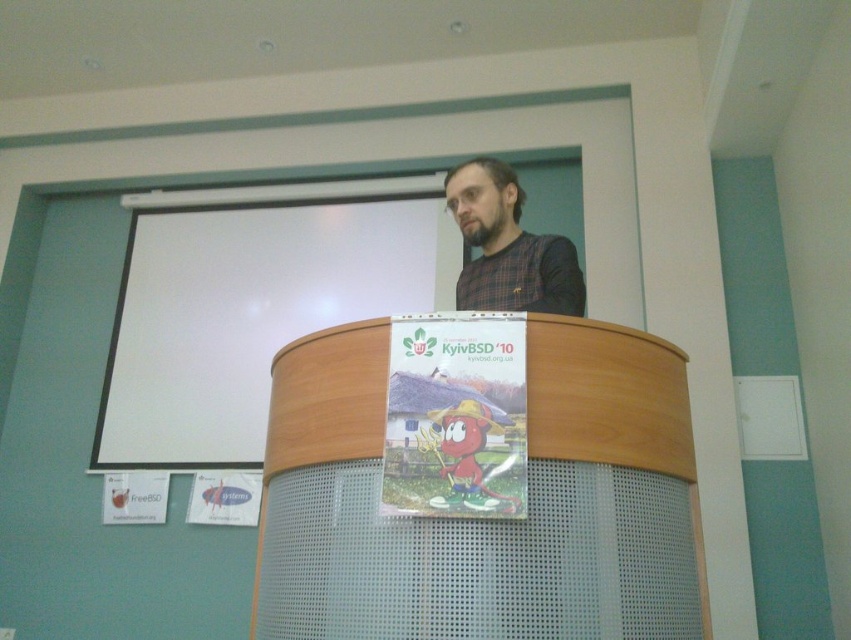
Is wooden podium at center thinner than plaid fabric shirt at center?

In fact, wooden podium at center might be wider than plaid fabric shirt at center.

Is point (549, 372) farther from viewer compared to point (580, 269)?

No, (549, 372) is in front of (580, 269).

The image size is (851, 640). In order to click on wooden podium at center in this screenshot , I will do click(486, 518).

Is wooden podium at center wider than white matte projection screen at upper center?

No.

This screenshot has height=640, width=851. Identify the location of wooden podium at center. (486, 518).

Is point (167, 458) in front of point (509, 305)?

No, it is not.

Does white matte projection screen at upper center appear over plaid fabric shirt at center?

Correct, white matte projection screen at upper center is located above plaid fabric shirt at center.

Which is behind, point (290, 278) or point (455, 188)?

The point (290, 278) is more distant.

The width and height of the screenshot is (851, 640). I want to click on white matte projection screen at upper center, so click(252, 307).